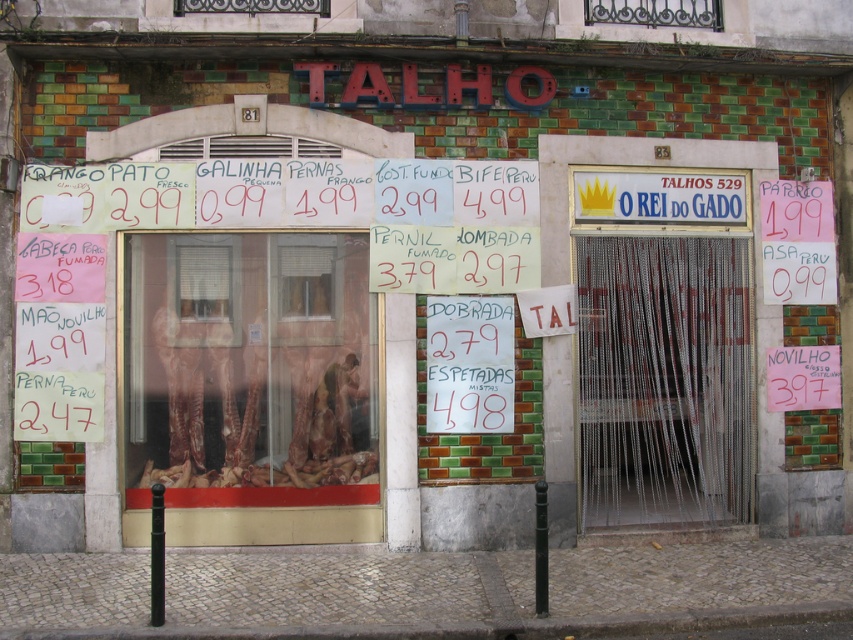
Question: Is the position of metal chain curtain at center less distant than that of metallic wrought iron at upper center?

Choices:
 (A) no
 (B) yes

Answer: (B)

Question: Which object appears closest to the camera in this image?

Choices:
 (A) white paper sign at center
 (B) metallic glass window at upper center

Answer: (A)

Question: Estimate the real-world distances between objects in this image. Which object is farther from the white paper sign at center?

Choices:
 (A) white paper sign at upper right
 (B) metallic wrought iron at upper center
 (C) metal chain curtain at center
 (D) translucent glass at center

Answer: (B)

Question: Is metal chain curtain at center to the left of metallic wrought iron at upper center from the viewer's perspective?

Choices:
 (A) yes
 (B) no

Answer: (B)

Question: Can you confirm if metal chain curtain at center is thinner than metallic glass window at upper center?

Choices:
 (A) no
 (B) yes

Answer: (A)

Question: Which of the following is the farthest from the observer?

Choices:
 (A) (780, 291)
 (B) (469, 387)

Answer: (A)